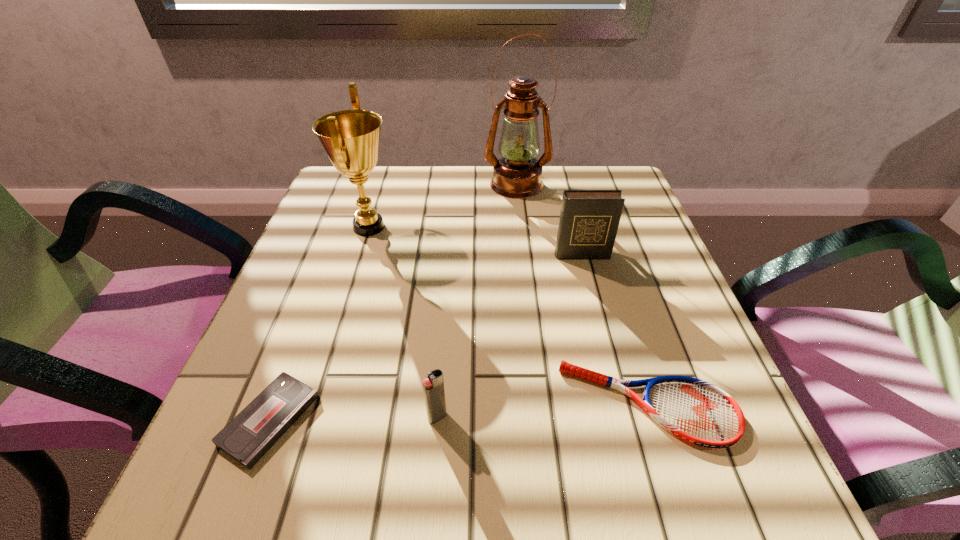
Where is `the farthest object`? The image size is (960, 540). the farthest object is located at coordinates (517, 174).

This screenshot has height=540, width=960. Find the location of `the tallest object`. the tallest object is located at coordinates (517, 174).

You are a GUI agent. You are given a task and a screenshot of the screen. Output one action in this format:
    pyautogui.click(x=<x>, y=<y>)
    Task: Click on the award
    This screenshot has height=540, width=960.
    Given the screenshot: What is the action you would take?
    pyautogui.click(x=351, y=138)

Find the location of a particular element. This screenshot has height=540, width=960. the fourth shortest object is located at coordinates (589, 219).

What are the coordinates of `the fourth tallest object` in the screenshot? It's located at (433, 385).

Locate an element on the screen. The width and height of the screenshot is (960, 540). the fourth object from right to left is located at coordinates (433, 385).

At what (x,y) coordinates should I click in order to perform the action: click on tennis racket. Please return your answer as a coordinate pair (x, y). Looking at the image, I should click on pyautogui.click(x=698, y=412).

At what (x,y) coordinates should I click in order to perform the action: click on videotape. Please return your answer as a coordinate pair (x, y). Looking at the image, I should click on (246, 438).

I want to click on free space located 0.190m on the front of the oil lamp, so click(x=524, y=248).

Locate an element on the screen. free region located on the front view with handles of the fifth shortest object is located at coordinates (429, 227).